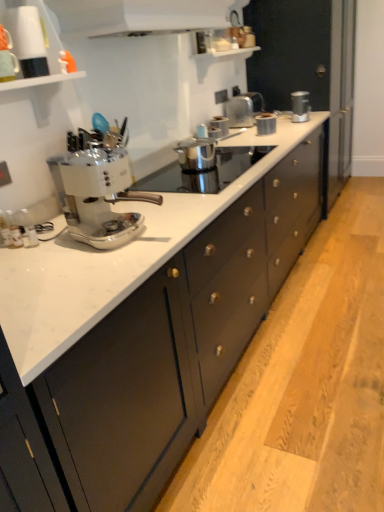
Measure the distance between metallic silver toaster at center, the 2th appliance viewed from the top, and camera.

A distance of 2.85 meters exists between metallic silver toaster at center, the 2th appliance viewed from the top, and camera.

Locate an element on the screen. matte black cabinets at center is located at coordinates (151, 313).

The height and width of the screenshot is (512, 384). In order to click on white glossy range hood at upper center in this screenshot , I will do `click(169, 17)`.

Find the location of a particular element. This screenshot has height=512, width=384. metallic silver toaster at center, the second appliance in the back-to-front sequence is located at coordinates (218, 126).

Is metallic silver toaster at center, the second appliance in the right-to-left sequence, far from metallic silver toaster at upper right, positioned as the second kitchen appliance in left-to-right order?

No, metallic silver toaster at center, the second appliance in the right-to-left sequence, is in close proximity to metallic silver toaster at upper right, positioned as the second kitchen appliance in left-to-right order.

In order to click on kitchen appliance above the metallic silver toaster at center, the second appliance in the right-to-left sequence (from the image's perspective) in this screenshot , I will do `click(300, 106)`.

Between metallic silver toaster at center, the 1th appliance from the front, and metallic silver toaster at upper right, the first kitchen appliance when ordered from right to left, which one has more height?

metallic silver toaster at upper right, the first kitchen appliance when ordered from right to left.

Which is closer to the camera, [228,121] or [297,99]?

The point [228,121] is in front.

From the image's perspective, is metallic silver toaster at upper right, positioned as the 1th kitchen appliance in back-to-front order, above white glossy coffee maker at center?

Yes, from the image's perspective, metallic silver toaster at upper right, positioned as the 1th kitchen appliance in back-to-front order, is above white glossy coffee maker at center.

Is metallic silver toaster at upper right, acting as the first kitchen appliance starting from the top, aimed at white glossy coffee maker at center?

No, metallic silver toaster at upper right, acting as the first kitchen appliance starting from the top, is not turned towards white glossy coffee maker at center.

Between metallic silver toaster at upper right, acting as the first kitchen appliance starting from the top, and white glossy coffee maker at center, which one has larger width?

Wider between the two is white glossy coffee maker at center.

Is metallic silver toaster at upper right, positioned as the second kitchen appliance in left-to-right order, bigger than white glossy coffee maker at center?

No.

Are metallic silver toaster at upper right, acting as the first kitchen appliance starting from the top, and metallic silver toaster at center, which is counted as the 2th appliance, starting from the bottom, far apart?

That's not correct — metallic silver toaster at upper right, acting as the first kitchen appliance starting from the top, is a little close to metallic silver toaster at center, which is counted as the 2th appliance, starting from the bottom.

Would you say metallic silver toaster at upper right, acting as the first kitchen appliance starting from the top, is to the left or to the right of metallic silver toaster at center, positioned as the 2th appliance in left-to-right order, in the picture?

In the image, metallic silver toaster at upper right, acting as the first kitchen appliance starting from the top, appears on the right side of metallic silver toaster at center, positioned as the 2th appliance in left-to-right order.

From the image's perspective, is metallic silver toaster at upper right, the first kitchen appliance when ordered from right to left, above or below metallic silver toaster at center, which is counted as the first appliance, starting from the back?

Based on their image positions, metallic silver toaster at upper right, the first kitchen appliance when ordered from right to left, is located beneath metallic silver toaster at center, which is counted as the first appliance, starting from the back.

From the image's perspective, which is above, white glossy coffee maker at center or metallic silver toaster at upper center, which appears as the 2th kitchen appliance when viewed from the right?

metallic silver toaster at upper center, which appears as the 2th kitchen appliance when viewed from the right, is shown above in the image.

Is metallic silver toaster at upper center, arranged as the first kitchen appliance when viewed from the left, at the back of white glossy coffee maker at center?

white glossy coffee maker at center is not turned away from metallic silver toaster at upper center, arranged as the first kitchen appliance when viewed from the left.

From a real-world perspective, who is located higher, white glossy coffee maker at center or metallic silver toaster at upper center, arranged as the first kitchen appliance when viewed from the left?

white glossy coffee maker at center is physically above.

Considering the sizes of objects white glossy coffee maker at center and metallic silver toaster at upper center, arranged as the first kitchen appliance when viewed from the left, in the image provided, who is bigger, white glossy coffee maker at center or metallic silver toaster at upper center, arranged as the first kitchen appliance when viewed from the left,?

white glossy coffee maker at center is bigger.

There is a metallic silver toaster at center, the 2th appliance viewed from the top. Identify the location of the 1st kitchen appliance above it (from a real-world perspective). (266, 124).

Which is closer, (x=216, y=122) or (x=275, y=117)?

Point (x=216, y=122) is positioned closer to the camera compared to point (x=275, y=117).

Is metallic silver toaster at center, the 1th appliance from the bottom, positioned beyond the bounds of metallic silver toaster at upper center, which appears as the second kitchen appliance when viewed from the top?

metallic silver toaster at center, the 1th appliance from the bottom, lies outside metallic silver toaster at upper center, which appears as the second kitchen appliance when viewed from the top,'s area.

From the image's perspective, which is below, white glossy coffee maker at center or white glossy range hood at upper center?

white glossy coffee maker at center.

Are white glossy coffee maker at center and white glossy range hood at upper center making contact?

white glossy coffee maker at center and white glossy range hood at upper center are clearly separated.

Between white glossy coffee maker at center and white glossy range hood at upper center, which one has less height?

white glossy range hood at upper center.

From a real-world perspective, which is physically above, white glossy coffee maker at center or white glossy range hood at upper center?

From a 3D spatial view, white glossy range hood at upper center is above.

From a real-world perspective, between metallic silver toaster at center, which is counted as the first appliance, starting from the back, and metallic silver toaster at upper center, acting as the 1th kitchen appliance starting from the bottom, who is vertically higher?

metallic silver toaster at center, which is counted as the first appliance, starting from the back, is physically above.

Considering the positions of objects metallic silver toaster at center, placed as the first appliance when sorted from top to bottom, and metallic silver toaster at upper center, which appears as the 2th kitchen appliance when viewed from the right, in the image provided, who is behind, metallic silver toaster at center, placed as the first appliance when sorted from top to bottom, or metallic silver toaster at upper center, which appears as the 2th kitchen appliance when viewed from the right,?

metallic silver toaster at center, placed as the first appliance when sorted from top to bottom, is behind.

From the image's perspective, does metallic silver toaster at center, marked as the second appliance in a front-to-back arrangement, appear lower than metallic silver toaster at upper center, which is counted as the second kitchen appliance, starting from the back?

No.

From a real-world perspective, which kitchen appliance is the 2nd one above the metallic silver toaster at center, the second appliance in the right-to-left sequence? Please provide its 2D coordinates.

[(300, 106)]

Locate an element on the screen. This screenshot has height=512, width=384. coffee maker located below the metallic silver toaster at upper right, positioned as the second kitchen appliance in left-to-right order (from the image's perspective) is located at coordinates (98, 195).

From the picture: Estimate the real-world distances between objects in this image. Which object is further from metallic silver toaster at upper center, acting as the 1th kitchen appliance starting from the bottom, white glossy mug at upper left or metallic silver toaster at center, the 2th appliance viewed from the top?

white glossy mug at upper left.

When comparing their distances from metallic silver toaster at upper right, positioned as the 2th kitchen appliance in bottom-to-top order, does metallic silver toaster at center, the first appliance viewed from the left, or white glossy range hood at upper center seem further?

white glossy range hood at upper center.

Based on their spatial positions, is white glossy coffee maker at center or metallic silver toaster at upper center, which is counted as the second kitchen appliance, starting from the back, closer to metallic silver toaster at upper right, marked as the 2th kitchen appliance in a front-to-back arrangement?

Based on the image, metallic silver toaster at upper center, which is counted as the second kitchen appliance, starting from the back, appears to be nearer to metallic silver toaster at upper right, marked as the 2th kitchen appliance in a front-to-back arrangement.

Consider the image. Looking at the image, which one is located further to metallic silver toaster at upper center, which is counted as the second kitchen appliance, starting from the back, white glossy coffee maker at center or metallic silver toaster at center, marked as the second appliance in a front-to-back arrangement?

white glossy coffee maker at center is positioned further to the anchor metallic silver toaster at upper center, which is counted as the second kitchen appliance, starting from the back.

Estimate the real-world distances between objects in this image. Which object is further from matte black cabinets at center, metallic silver toaster at center, which is counted as the first appliance, starting from the back, or white glossy range hood at upper center?

Based on the image, metallic silver toaster at center, which is counted as the first appliance, starting from the back, appears to be further to matte black cabinets at center.

When comparing their distances from matte black cabinets at center, does metallic silver toaster at upper right, positioned as the second kitchen appliance in left-to-right order, or metallic silver toaster at center, marked as the second appliance in a front-to-back arrangement, seem further?

metallic silver toaster at upper right, positioned as the second kitchen appliance in left-to-right order, is positioned further to the anchor matte black cabinets at center.

Looking at the image, which one is located closer to white glossy coffee maker at center, matte black cabinets at center or metallic silver toaster at upper right, the first kitchen appliance when ordered from right to left?

matte black cabinets at center.

When comparing their distances from metallic silver toaster at center, the 2th appliance viewed from the top, does metallic silver toaster at upper right, positioned as the second kitchen appliance in left-to-right order, or white glossy range hood at upper center seem further?

white glossy range hood at upper center lies further to metallic silver toaster at center, the 2th appliance viewed from the top, than the other object.

Locate an element on the screen. The width and height of the screenshot is (384, 512). home appliance between white glossy mug at upper left and metallic silver toaster at upper center, which appears as the second kitchen appliance when viewed from the top, along the z-axis is located at coordinates (169, 17).

The image size is (384, 512). In order to click on home appliance between white glossy mug at upper left and metallic silver toaster at center, the 1th appliance from the bottom, along the z-axis in this screenshot , I will do `click(169, 17)`.

Locate an element on the screen. shelf between white glossy coffee maker at center and metallic silver toaster at center, which is counted as the first appliance, starting from the back, in the front-back direction is located at coordinates [x=42, y=79].

In order to click on shelf located between matte black cabinets at center and metallic silver toaster at upper right, the first kitchen appliance when ordered from right to left, in the depth direction in this screenshot , I will do `click(42, 79)`.